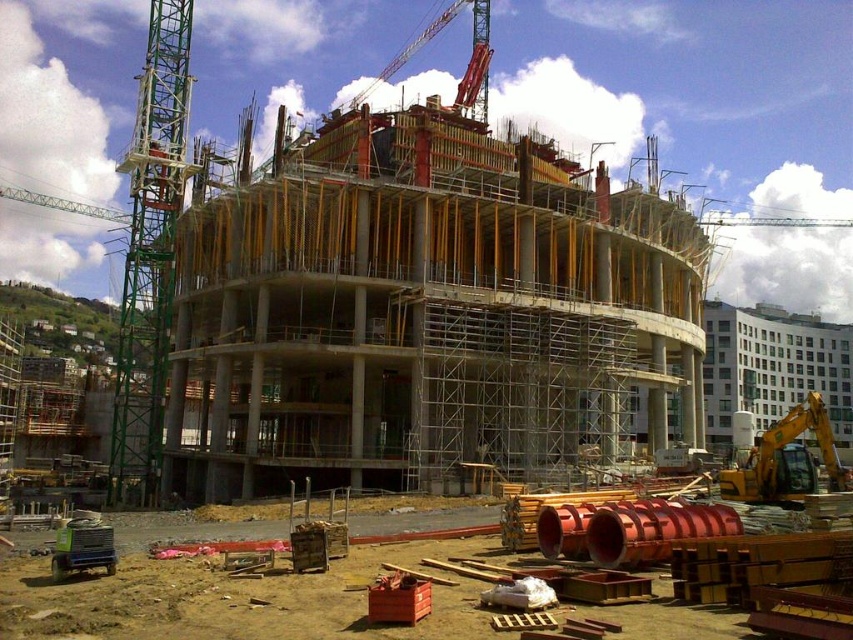
You are a delivery truck driver who needs to pass through the construction site. The truck is 3 meters wide. There is a yellow metallic excavator at lower right and a metallic red crane at upper center. Which equipment might block your path if you try to drive through the site?

The yellow metallic excavator at lower right might block your path since it is wider than the metallic red crane at upper center, and the truck is 3 meters wide.

You are a construction worker who needs to transport materials from the orange metallic pipes at lower center to the green metallic crane at left. Given that your forklift has a maximum range of 100 feet, can you safely make the trip without needing to refuel?

The distance between the orange metallic pipes at lower center and the green metallic crane at left is 118.08 feet, which exceeds the forklifts maximum range of 100 feet. Therefore, you cannot safely make the trip without needing to refuel.